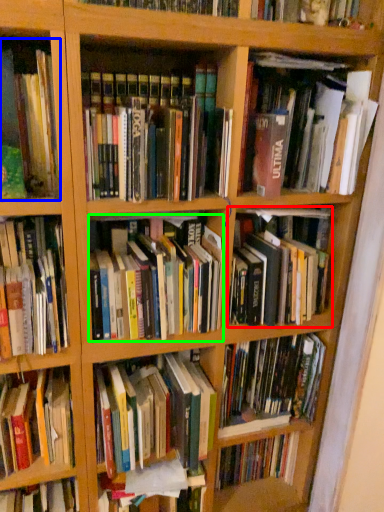
Question: Based on their relative distances, which object is nearer to book (highlighted by a red box)? Choose from book (highlighted by a blue box) and book (highlighted by a green box).

Choices:
 (A) book
 (B) book

Answer: (B)